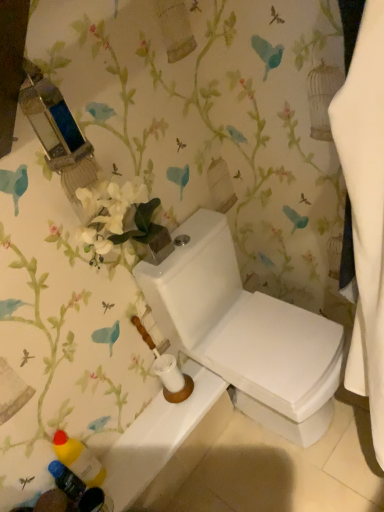
Question: From the image's perspective, is blue plastic bottle at lower left, marked as the 2th toiletry in a top-to-bottom arrangement, beneath white glossy toilet at lower center?

Choices:
 (A) no
 (B) yes

Answer: (B)

Question: Considering the relative sizes of blue plastic bottle at lower left, marked as the 2th toiletry in a top-to-bottom arrangement, and white glossy toilet at lower center in the image provided, is blue plastic bottle at lower left, marked as the 2th toiletry in a top-to-bottom arrangement, smaller than white glossy toilet at lower center?

Choices:
 (A) no
 (B) yes

Answer: (B)

Question: From a real-world perspective, is blue plastic bottle at lower left, which ranks as the 1th toiletry in bottom-to-top order, on top of white glossy toilet at lower center?

Choices:
 (A) no
 (B) yes

Answer: (B)

Question: Does blue plastic bottle at lower left, marked as the 2th toiletry in a top-to-bottom arrangement, have a greater width compared to white glossy toilet at lower center?

Choices:
 (A) no
 (B) yes

Answer: (A)

Question: Considering the relative sizes of blue plastic bottle at lower left, marked as the 2th toiletry in a top-to-bottom arrangement, and white glossy toilet at lower center in the image provided, is blue plastic bottle at lower left, marked as the 2th toiletry in a top-to-bottom arrangement, bigger than white glossy toilet at lower center?

Choices:
 (A) no
 (B) yes

Answer: (A)

Question: Does blue plastic bottle at lower left, which ranks as the 1th toiletry in bottom-to-top order, come behind white glossy toilet at lower center?

Choices:
 (A) yes
 (B) no

Answer: (B)

Question: From a real-world perspective, is white glossy toilet at center under white glossy toilet at lower center?

Choices:
 (A) no
 (B) yes

Answer: (A)

Question: From the image's perspective, is white glossy toilet at center above white glossy toilet at lower center?

Choices:
 (A) yes
 (B) no

Answer: (A)

Question: Considering the relative positions of white glossy toilet at center and white glossy toilet at lower center in the image provided, is white glossy toilet at center behind white glossy toilet at lower center?

Choices:
 (A) no
 (B) yes

Answer: (A)

Question: Is white glossy toilet at center closer to camera compared to white glossy toilet at lower center?

Choices:
 (A) no
 (B) yes

Answer: (B)

Question: Can you confirm if white glossy toilet at center is bigger than white glossy toilet at lower center?

Choices:
 (A) yes
 (B) no

Answer: (A)

Question: Is white glossy toilet at center shorter than white glossy toilet at lower center?

Choices:
 (A) yes
 (B) no

Answer: (B)

Question: Is white glossy toilet at center facing towards blue plastic bottle at lower left, which ranks as the 1th toiletry in bottom-to-top order?

Choices:
 (A) yes
 (B) no

Answer: (B)